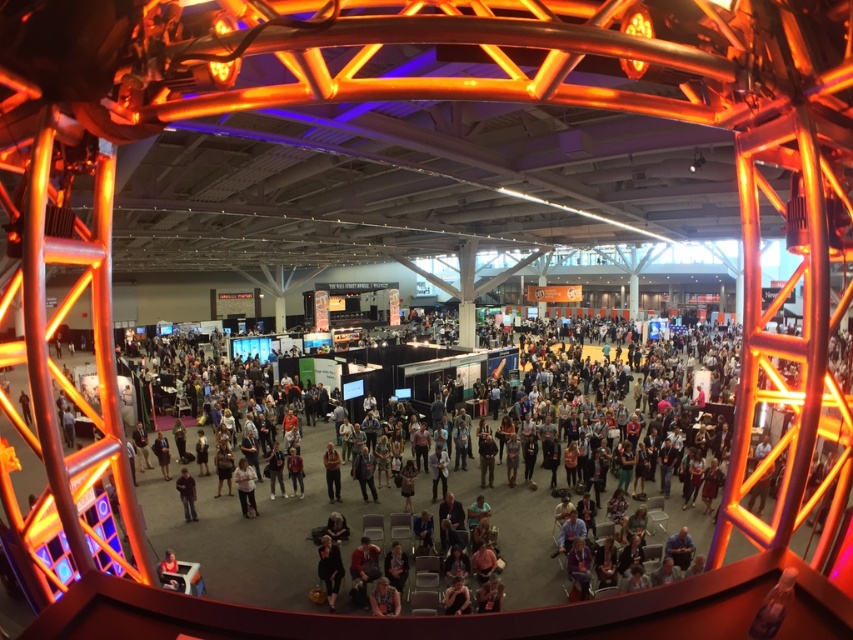
You are organizing a coat check for an event and have two jackets to hang. The black fabric jacket at lower center and the light brown leather jacket at center. Which jacket requires a smaller hanger?

The black fabric jacket at lower center requires a smaller hanger since it has a smaller size compared to the light brown leather jacket at center.

You are an attendee at this event and want to grab your jacket before moving to the next session. Which jacket is easier to reach without moving further into the crowd? The black fabric jacket at lower center or the light brown leather jacket at center?

The black fabric jacket at lower center is closer to the viewer, so it is easier to reach without moving further into the crowd than the light brown leather jacket at center.